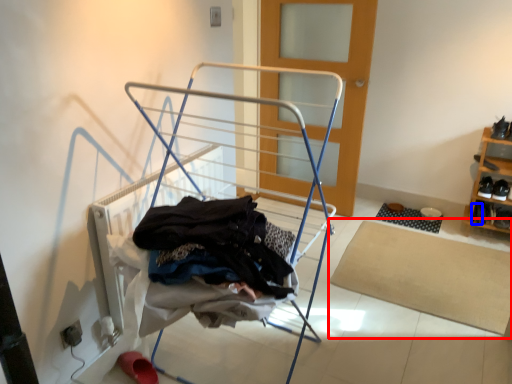
Question: Which point is further to the camera, mat (highlighted by a red box) or shoe (highlighted by a blue box)?

Choices:
 (A) mat
 (B) shoe

Answer: (B)